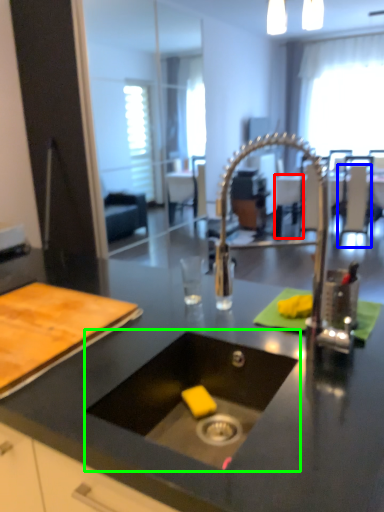
Question: Which object is positioned closest to chair (highlighted by a red box)? Select from chair (highlighted by a blue box) and sink (highlighted by a green box).

Choices:
 (A) chair
 (B) sink

Answer: (A)